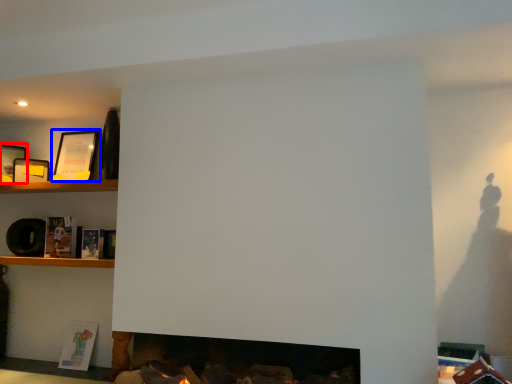
Question: Which object appears farthest to the camera in this image, picture frame (highlighted by a red box) or picture frame (highlighted by a blue box)?

Choices:
 (A) picture frame
 (B) picture frame

Answer: (B)